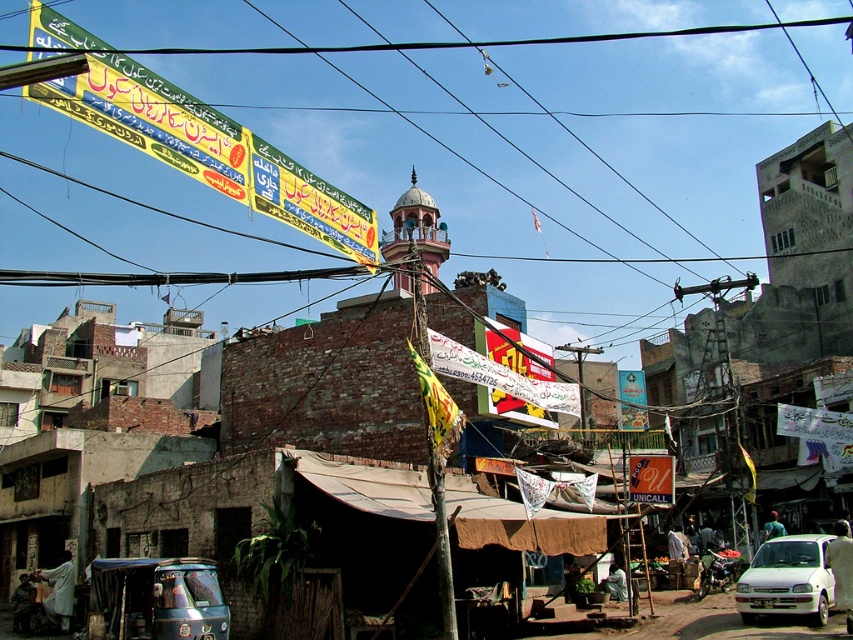
Is white matte car at lower right taller than pink marble minaret at center?

Incorrect, white matte car at lower right's height is not larger of pink marble minaret at center's.

Which is in front, point (770, 564) or point (416, 218)?

Point (770, 564) is more forward.

Who is more forward, (817,564) or (399,218)?

Positioned in front is point (817,564).

Identify the location of white matte car at lower right. (787, 579).

Which of these two, metallic green auto-rickshaw at lower left or white matte car at lower right, stands shorter?

Standing shorter between the two is metallic green auto-rickshaw at lower left.

Can you confirm if metallic green auto-rickshaw at lower left is bigger than white matte car at lower right?

No, metallic green auto-rickshaw at lower left is not bigger than white matte car at lower right.

What do you see at coordinates (158, 598) in the screenshot?
I see `metallic green auto-rickshaw at lower left` at bounding box center [158, 598].

Where is `metallic green auto-rickshaw at lower left`? metallic green auto-rickshaw at lower left is located at coordinates (158, 598).

Locate an element on the screen. This screenshot has width=853, height=640. metallic green auto-rickshaw at lower left is located at coordinates (158, 598).

Who is positioned more to the right, metallic green auto-rickshaw at lower left or pink marble minaret at center?

From the viewer's perspective, pink marble minaret at center appears more on the right side.

Does point (160, 593) lie in front of point (428, 259)?

That is True.

Find the location of a particular element. Image resolution: width=853 pixels, height=640 pixels. metallic green auto-rickshaw at lower left is located at coordinates (158, 598).